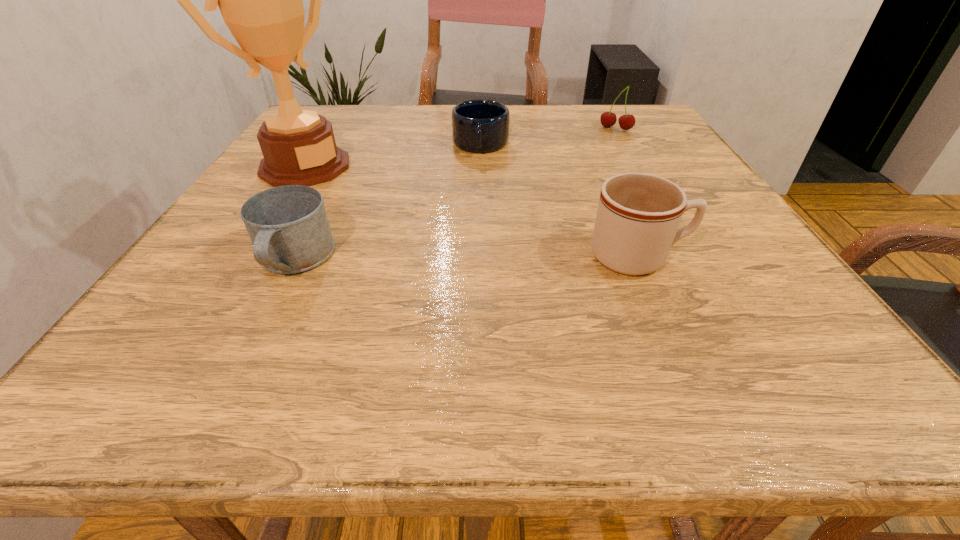
This screenshot has height=540, width=960. I want to click on vacant region located on the surface of the cherry, so click(x=585, y=163).

Where is `vacant point located 0.370m on the surface of the cherry`? The image size is (960, 540). vacant point located 0.370m on the surface of the cherry is located at coordinates (555, 198).

Find the location of a particular element. The image size is (960, 540). free location located on the front-facing side of the award is located at coordinates (450, 249).

Locate an element on the screen. The height and width of the screenshot is (540, 960). vacant position located 0.070m on the front-facing side of the award is located at coordinates (350, 193).

Find the location of a particular element. The height and width of the screenshot is (540, 960). blank space located on the front-facing side of the award is located at coordinates (422, 234).

You are a GUI agent. You are given a task and a screenshot of the screen. Output one action in this format:
    pyautogui.click(x=<x>, y=<y>)
    Task: Click on the mug located at the far edge
    
    Given the screenshot: What is the action you would take?
    pyautogui.click(x=480, y=126)

What are the coordinates of `cherry that is at the far edge` in the screenshot? It's located at [608, 119].

Find the location of a particular element. This screenshot has width=960, height=540. object that is positioned at the near edge is located at coordinates (288, 226).

The image size is (960, 540). Identify the location of mug present at the left edge. (288, 226).

What are the coordinates of `award present at the left edge` in the screenshot? It's located at (260, 0).